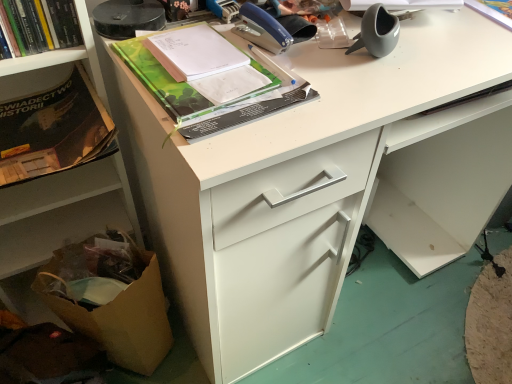
Question: Looking at their shapes, would you say matte gray vase at upper right, the 1th office supplies positioned from the right, is wider or thinner than hardcover book at upper left, the third book positioned from the right?

Choices:
 (A) wide
 (B) thin

Answer: (B)

Question: Is matte gray vase at upper right, which is the 2th office supplies in left-to-right order, spatially inside hardcover book at upper left, the third book positioned from the right, or outside of it?

Choices:
 (A) outside
 (B) inside

Answer: (A)

Question: Based on their relative distances, which object is nearer to the green matte book at upper center, acting as the 2th book starting from the right?

Choices:
 (A) matte gray vase at upper right, which is the 2th office supplies in left-to-right order
 (B) brown paper bag at lower left
 (C) white paper at upper right, which is the first book from right to left
 (D) brown cardboard box at lower left
 (E) matte black book at left

Answer: (E)

Question: Which is nearer to the matte black book at left?

Choices:
 (A) green matte book at upper center, the second book when ordered from left to right
 (B) brown cardboard box at lower left
 (C) hardcover book at upper left, which is the 1th book in left-to-right order
 (D) matte gray vase at upper right, the 1th office supplies positioned from the right
 (E) brown paper bag at lower left

Answer: (B)